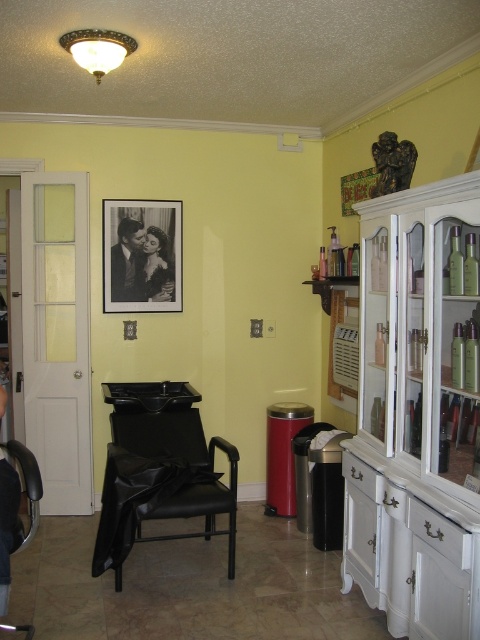
Can you confirm if white glossy cabinet at right is positioned to the right of metallic silver calendar at center?

Correct, you'll find white glossy cabinet at right to the right of metallic silver calendar at center.

Can you confirm if white glossy cabinet at right is taller than metallic silver calendar at center?

Yes.

Is point (380, 538) more distant than point (336, 360)?

No, it is in front of (336, 360).

Where is `white glossy cabinet at right`? white glossy cabinet at right is located at coordinates tap(418, 412).

Does point (450, 563) come farther from viewer compared to point (15, 442)?

That is False.

Can you confirm if white glossy cabinet at right is smaller than black leather armchair at lower left?

No.

In order to click on white glossy cabinet at right in this screenshot , I will do `click(418, 412)`.

Locate an element on the screen. white glossy cabinet at right is located at coordinates (418, 412).

Between point (445, 324) and point (172, 282), which one is positioned in front?

Point (445, 324) is more forward.

The width and height of the screenshot is (480, 640). Find the location of `white glossy cabinet at right`. white glossy cabinet at right is located at coordinates (418, 412).

The image size is (480, 640). In order to click on white glossy cabinet at right in this screenshot , I will do `click(418, 412)`.